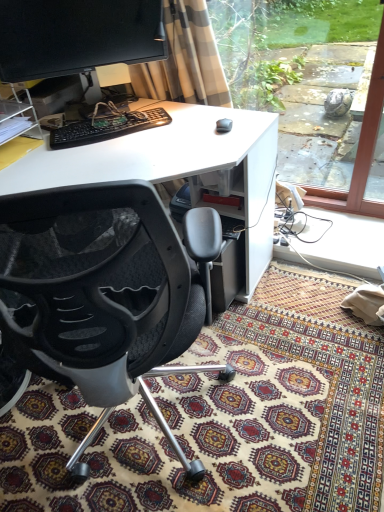
In order to click on free spot in front of black plastic keyboard at center in this screenshot , I will do `click(110, 152)`.